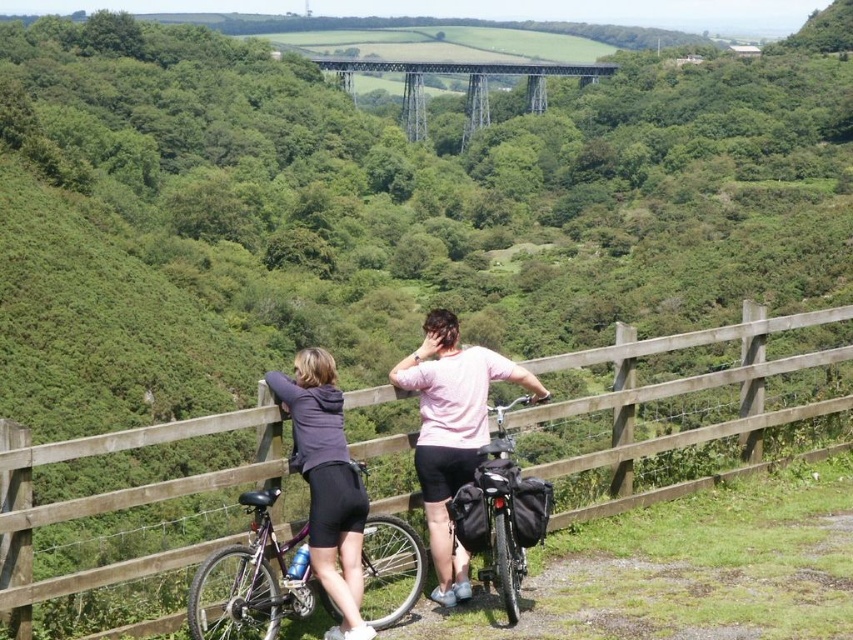
Who is shorter, shiny purple bicycle at center or matte black bicycle at center?

With less height is shiny purple bicycle at center.

Can you confirm if shiny purple bicycle at center is taller than matte black bicycle at center?

No.

Is point (223, 595) positioned before point (514, 570)?

Yes.

I want to click on shiny purple bicycle at center, so click(x=254, y=580).

Does point (401, 449) come in front of point (424, 131)?

Yes, it is.

Which is behind, point (729, 435) or point (432, 68)?

The point (432, 68) is behind.

Find the location of a particular element. wooden fence at center is located at coordinates (679, 385).

Who is positioned more to the left, matte pink shirt at center or matte black bicycle at center?

From the viewer's perspective, matte pink shirt at center appears more on the left side.

Which is more to the right, matte pink shirt at center or matte black bicycle at center?

matte black bicycle at center is more to the right.

Describe the element at coordinates (451, 432) in the screenshot. The width and height of the screenshot is (853, 640). I see `matte pink shirt at center` at that location.

At what (x,y) coordinates should I click in order to perform the action: click on matte pink shirt at center. Please return your answer as a coordinate pair (x, y). Looking at the image, I should click on (451, 432).